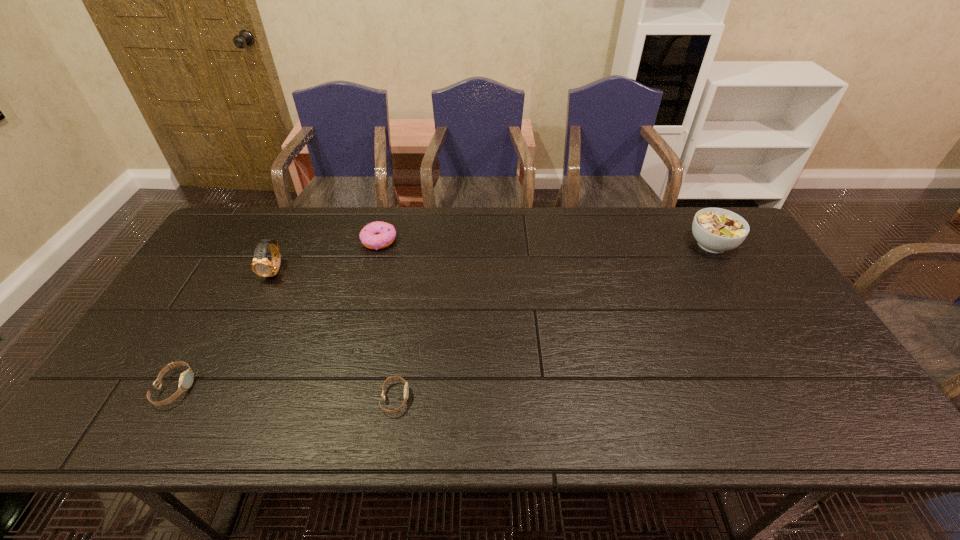
This screenshot has width=960, height=540. Identify the location of free spot between the shortest object and the farthest watch. (335, 335).

The height and width of the screenshot is (540, 960). I want to click on vacant region between the second watch from left to right and the third object from left to right, so click(327, 255).

Find the location of `free space between the third object from right to left and the second watch from right to left`. free space between the third object from right to left and the second watch from right to left is located at coordinates (327, 255).

The width and height of the screenshot is (960, 540). I want to click on blank region between the tallest watch and the third object from right to left, so click(327, 255).

Find the location of a particular element. free point between the second object from right to left and the farthest watch is located at coordinates (335, 335).

The width and height of the screenshot is (960, 540). In order to click on object identified as the second closest to the doughnut in this screenshot , I will do `click(406, 388)`.

Point out which object is positioned as the third nearest to the second shortest watch. Please provide its 2D coordinates. Your answer should be formatted as a tuple, i.e. [(x, y)], where the tuple contains the x and y coordinates of a point satisfying the conditions above.

[(376, 235)]

Point out which watch is positioned as the second nearest to the second tallest watch. Please provide its 2D coordinates. Your answer should be formatted as a tuple, i.e. [(x, y)], where the tuple contains the x and y coordinates of a point satisfying the conditions above.

[(406, 388)]

Locate which watch is the second closest to the doughnut. Please provide its 2D coordinates. Your answer should be formatted as a tuple, i.e. [(x, y)], where the tuple contains the x and y coordinates of a point satisfying the conditions above.

[(406, 388)]